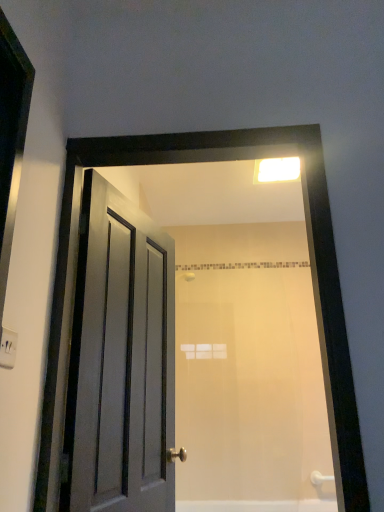
Identify the location of white plastic electric outlet at upper left. (8, 348).

Which is behind, matte wooden door at center or white plastic light fixture at upper center?

white plastic light fixture at upper center is further from the camera.

Looking at this image, is matte wooden door at center completely or partially outside of white plastic light fixture at upper center?

Yes, matte wooden door at center is located beyond the bounds of white plastic light fixture at upper center.

Is matte wooden door at center turned away from white plastic light fixture at upper center?

Yes, matte wooden door at center is positioned with its back facing white plastic light fixture at upper center.

Considering the relative sizes of white plastic electric outlet at upper left and white plastic light fixture at upper center in the image provided, is white plastic electric outlet at upper left smaller than white plastic light fixture at upper center?

Answer: Indeed, white plastic electric outlet at upper left has a smaller size compared to white plastic light fixture at upper center.

Is white plastic electric outlet at upper left positioned far away from white plastic light fixture at upper center?

Absolutely, white plastic electric outlet at upper left is distant from white plastic light fixture at upper center.

Can you confirm if white plastic electric outlet at upper left is thinner than white plastic light fixture at upper center?

Correct, the width of white plastic electric outlet at upper left is less than that of white plastic light fixture at upper center.

Does white matte bathtub at lower center lie behind matte wooden door at center?

Yes, white matte bathtub at lower center is behind matte wooden door at center.

Between point (232, 511) and point (187, 300), which one is positioned in front?

Point (232, 511)

From the image's perspective, which one is positioned higher, white matte bathtub at lower center or matte wooden door at center?

matte wooden door at center appears higher in the image.

Does white matte bathtub at lower center have a smaller size compared to matte wooden door at center?

Correct, white matte bathtub at lower center occupies less space than matte wooden door at center.

From the image's perspective, is white matte bathtub at lower center beneath white plastic electric outlet at upper left?

Correct, white matte bathtub at lower center appears lower than white plastic electric outlet at upper left in the image.

In the image, is white matte bathtub at lower center positioned in front of or behind white plastic electric outlet at upper left?

white matte bathtub at lower center is behind white plastic electric outlet at upper left.

What's the angular difference between white matte bathtub at lower center and white plastic electric outlet at upper left's facing directions?

white matte bathtub at lower center and white plastic electric outlet at upper left are facing 89.3 degrees away from each other.

Does matte gray door at left turn towards white matte bathtub at lower center?

No, matte gray door at left is not turned towards white matte bathtub at lower center.

In the scene shown: From the image's perspective, is matte gray door at left located above or below white matte bathtub at lower center?

Based on their image positions, matte gray door at left is located above white matte bathtub at lower center.

From a real-world perspective, is matte gray door at left physically located above or below white matte bathtub at lower center?

In terms of real-world spatial position, matte gray door at left is above white matte bathtub at lower center.

Is matte wooden door at center facing away from matte gray door at left?

Yes, matte wooden door at center is facing away from matte gray door at left.

In terms of height, does matte wooden door at center look taller or shorter compared to matte gray door at left?

Clearly, matte wooden door at center is shorter compared to matte gray door at left.

From a real-world perspective, is matte wooden door at center positioned under matte gray door at left based on gravity?

No, from a real-world perspective, matte wooden door at center is not beneath matte gray door at left.

Considering the relative sizes of white plastic electric outlet at upper left and matte gray door at left in the image provided, is white plastic electric outlet at upper left thinner than matte gray door at left?

Yes, white plastic electric outlet at upper left is thinner than matte gray door at left.

Which is behind, point (2, 335) or point (131, 426)?

The point (131, 426) is farther from the camera.

Where is `electric outlet that appears in front of the matte gray door at left`? electric outlet that appears in front of the matte gray door at left is located at coordinates point(8,348).

Would you consider white plastic electric outlet at upper left to be distant from matte gray door at left?

No, white plastic electric outlet at upper left is not far from matte gray door at left.

Where is `light fixture above the matte wooden door at center (from the image's perspective)`? light fixture above the matte wooden door at center (from the image's perspective) is located at coordinates (276, 170).

The width and height of the screenshot is (384, 512). Find the location of `electric outlet in front of the white plastic light fixture at upper center`. electric outlet in front of the white plastic light fixture at upper center is located at coordinates (8, 348).

When comparing their distances from matte wooden door at center, does white plastic electric outlet at upper left or matte gray door at left seem further?

white plastic electric outlet at upper left is positioned further to the anchor matte wooden door at center.

Estimate the real-world distances between objects in this image. Which object is further from white plastic light fixture at upper center, matte wooden door at center or white matte bathtub at lower center?

Among the two, white matte bathtub at lower center is located further to white plastic light fixture at upper center.

Considering their positions, is matte wooden door at center positioned further to matte gray door at left than white plastic light fixture at upper center?

The object further to matte gray door at left is white plastic light fixture at upper center.

From the image, which object appears to be nearer to matte gray door at left, white matte bathtub at lower center or matte wooden door at center?

matte wooden door at center.

From the image, which object appears to be nearer to white matte bathtub at lower center, matte wooden door at center or white plastic electric outlet at upper left?

matte wooden door at center.

From the image, which object appears to be farther from matte wooden door at center, matte gray door at left or white plastic electric outlet at upper left?

Among the two, white plastic electric outlet at upper left is located further to matte wooden door at center.

Estimate the real-world distances between objects in this image. Which object is further from white plastic light fixture at upper center, white plastic electric outlet at upper left or matte wooden door at center?

white plastic electric outlet at upper left.

Based on their spatial positions, is matte wooden door at center or white plastic electric outlet at upper left further from white plastic light fixture at upper center?

white plastic electric outlet at upper left is positioned further to the anchor white plastic light fixture at upper center.

Locate an element on the screen. The height and width of the screenshot is (512, 384). door between white plastic electric outlet at upper left and white matte bathtub at lower center in the front-back direction is located at coordinates (120, 361).

Identify the location of door positioned between white plastic electric outlet at upper left and white plastic light fixture at upper center from near to far. (120, 361).

Identify the location of mirror between white plastic light fixture at upper center and white matte bathtub at lower center in the up-down direction. (240, 331).

This screenshot has width=384, height=512. Identify the location of door between matte wooden door at center and white matte bathtub at lower center vertically. (120, 361).